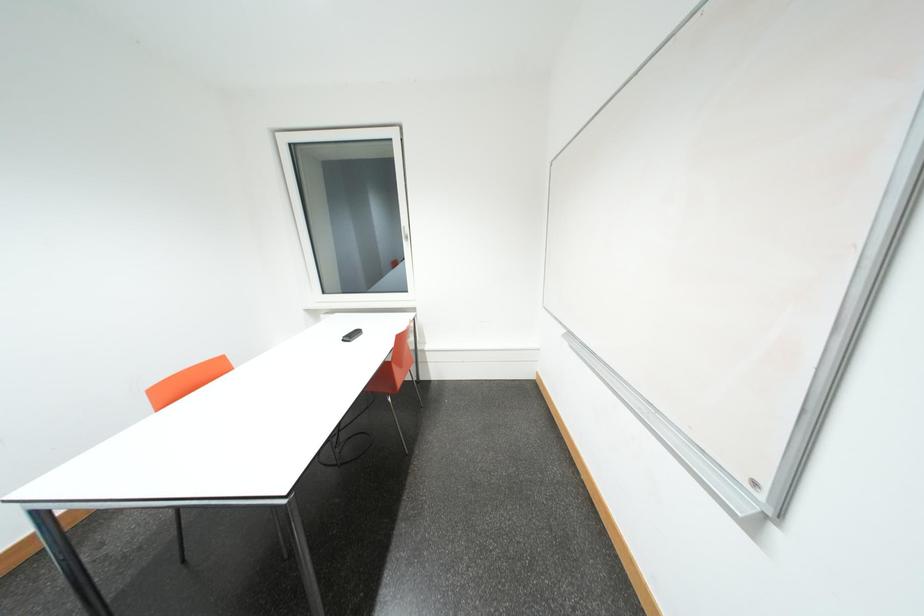
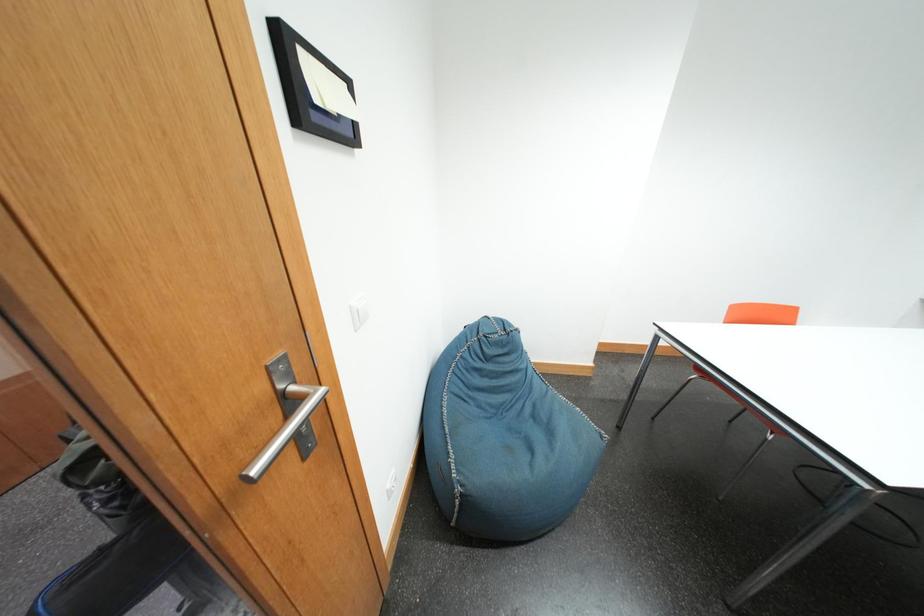
First-person continuous shooting, in which direction is the camera rotating?

The camera rotated toward left-down.